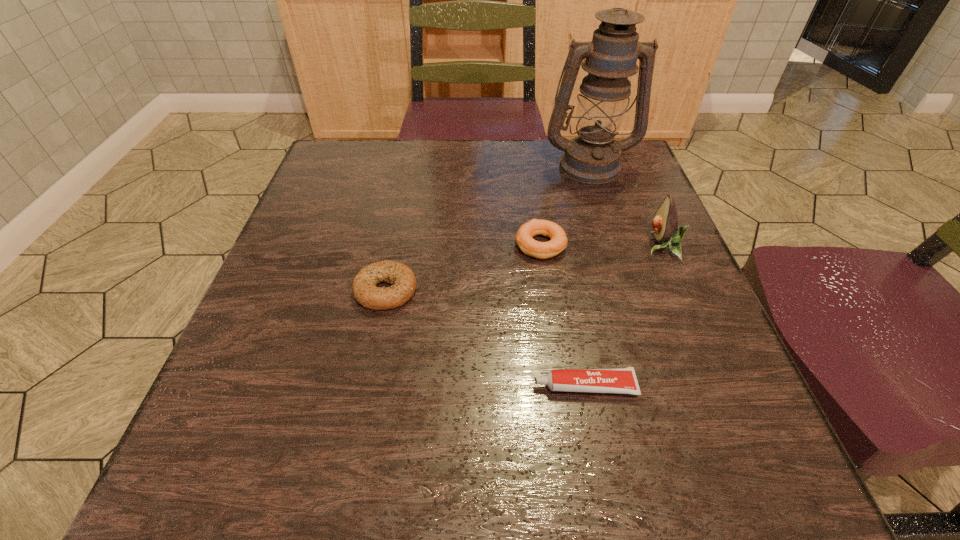
This screenshot has width=960, height=540. Identify the location of toothpaste that is at the right edge. (623, 380).

Where is `object situated at the far right corner`? This screenshot has width=960, height=540. object situated at the far right corner is located at coordinates click(592, 157).

In the image, there is a desktop. At what (x,y) coordinates should I click in order to perform the action: click on vacant space at the far edge. Please return your answer as a coordinate pair (x, y). Looking at the image, I should click on (458, 165).

I want to click on vacant space at the near edge, so click(519, 440).

This screenshot has width=960, height=540. What are the coordinates of `free space at the left edge of the desktop` in the screenshot? It's located at (338, 346).

Where is `free region at the right edge of the desktop`? This screenshot has height=540, width=960. free region at the right edge of the desktop is located at coordinates (699, 427).

I want to click on vacant space at the far left corner of the desktop, so click(x=348, y=155).

What are the coordinates of `free location at the near right corner of the desktop` in the screenshot? It's located at (723, 459).

The width and height of the screenshot is (960, 540). I want to click on vacant space that's between the oil lamp and the fourth farthest object, so click(x=488, y=228).

Identify the location of free space between the oil lamp and the nearest object. (587, 275).